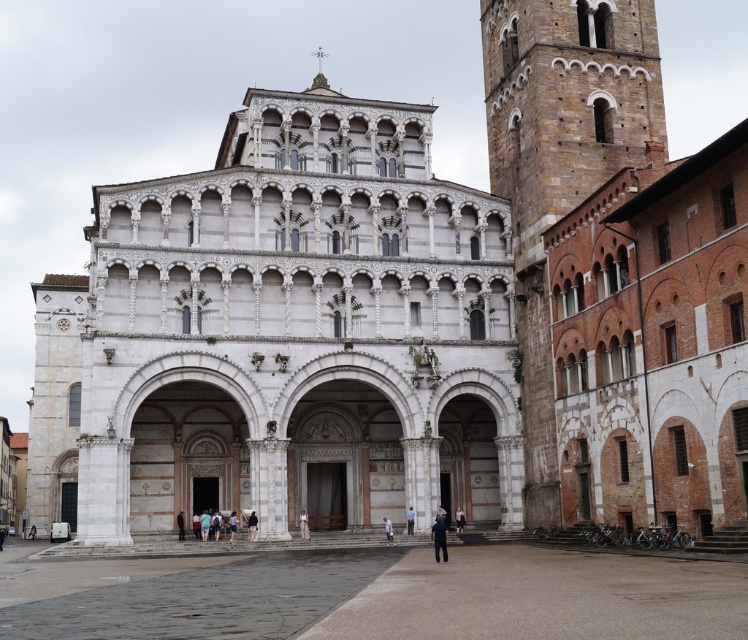
Question: Which point is farther to the camera?

Choices:
 (A) (444, 557)
 (B) (453, 513)
 (C) (383, 518)

Answer: (B)

Question: Is dark brown leather jacket at lower center wider than blue denim jeans at center?

Choices:
 (A) no
 (B) yes

Answer: (A)

Question: Considering the real-world distances, which object is farthest from the black leather jacket at center?

Choices:
 (A) white fabric bag at center
 (B) dark blue jeans at center
 (C) light beige fabric at center
 (D) brown stone tower at right

Answer: (D)

Question: Is dark blue fabric at center further to camera compared to dark blue jeans at center?

Choices:
 (A) no
 (B) yes

Answer: (A)

Question: Where is brown stone tower at right located in relation to light blue fabric at center in the image?

Choices:
 (A) above
 (B) below

Answer: (A)

Question: Which object is the closest to the dark blue fabric at center?

Choices:
 (A) light blue fabric at center
 (B) dark brown leather jacket at lower center
 (C) dark blue jeans at center
 (D) blue denim jeans at center

Answer: (D)